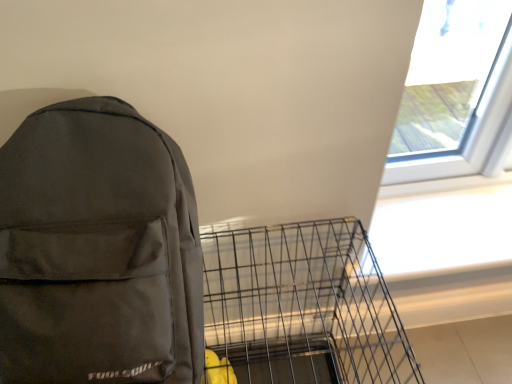
Question: Considering the relative sizes of metallic wire birdcage at lower center and matte black backpack at left in the image provided, is metallic wire birdcage at lower center thinner than matte black backpack at left?

Choices:
 (A) yes
 (B) no

Answer: (B)

Question: Can you confirm if metallic wire birdcage at lower center is bigger than matte black backpack at left?

Choices:
 (A) yes
 (B) no

Answer: (A)

Question: From the image's perspective, is metallic wire birdcage at lower center over matte black backpack at left?

Choices:
 (A) yes
 (B) no

Answer: (B)

Question: Is metallic wire birdcage at lower center at the left side of matte black backpack at left?

Choices:
 (A) yes
 (B) no

Answer: (B)

Question: From a real-world perspective, is metallic wire birdcage at lower center below matte black backpack at left?

Choices:
 (A) no
 (B) yes

Answer: (B)

Question: Is metallic wire birdcage at lower center to the left or to the right of transparent glass window at upper right in the image?

Choices:
 (A) right
 (B) left

Answer: (B)

Question: From a real-world perspective, is metallic wire birdcage at lower center physically located above or below transparent glass window at upper right?

Choices:
 (A) below
 (B) above

Answer: (A)

Question: Considering the positions of metallic wire birdcage at lower center and transparent glass window at upper right in the image, is metallic wire birdcage at lower center taller or shorter than transparent glass window at upper right?

Choices:
 (A) short
 (B) tall

Answer: (B)

Question: Considering the positions of metallic wire birdcage at lower center and transparent glass window at upper right in the image, is metallic wire birdcage at lower center wider or thinner than transparent glass window at upper right?

Choices:
 (A) thin
 (B) wide

Answer: (B)

Question: Based on their positions, is matte black backpack at left located to the left or right of metallic wire birdcage at lower center?

Choices:
 (A) right
 (B) left

Answer: (B)

Question: Is matte black backpack at left inside or outside of metallic wire birdcage at lower center?

Choices:
 (A) inside
 (B) outside

Answer: (B)

Question: Does point (14, 253) appear closer or farther from the camera than point (355, 238)?

Choices:
 (A) closer
 (B) farther

Answer: (A)

Question: Is matte black backpack at left in front of or behind metallic wire birdcage at lower center in the image?

Choices:
 (A) behind
 (B) front

Answer: (B)

Question: From the image's perspective, is transparent glass window at upper right positioned above or below metallic wire birdcage at lower center?

Choices:
 (A) above
 (B) below

Answer: (A)

Question: Is transparent glass window at upper right inside the boundaries of metallic wire birdcage at lower center, or outside?

Choices:
 (A) outside
 (B) inside

Answer: (A)